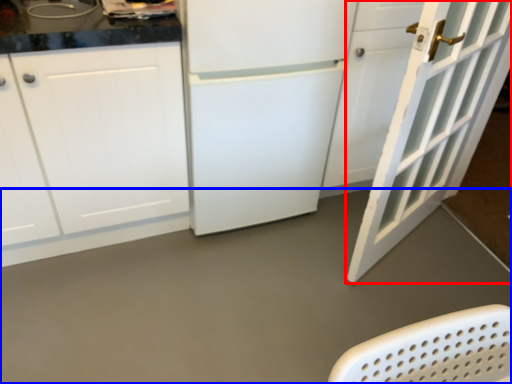
Question: Among these objects, which one is farthest to the camera, door (highlighted by a red box) or concrete (highlighted by a blue box)?

Choices:
 (A) door
 (B) concrete

Answer: (B)